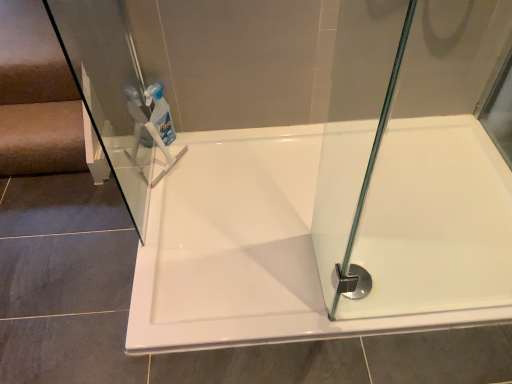
You are a GUI agent. You are given a task and a screenshot of the screen. Output one action in this format:
    pyautogui.click(x=<x>, y=<y>)
    Task: Click on the vacant space in front of polished chrome shower at bottom right
    
    Given the screenshot: What is the action you would take?
    pyautogui.click(x=365, y=345)